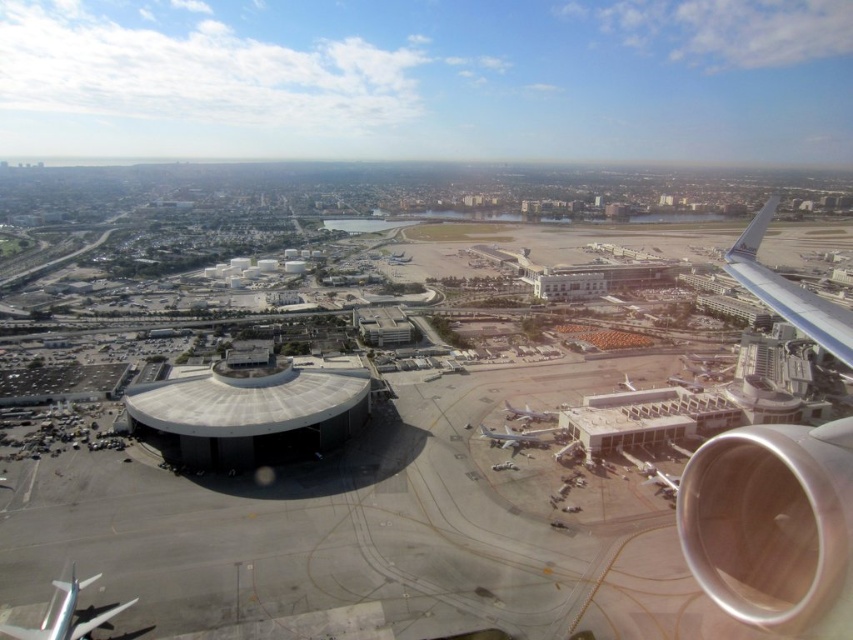
You are a pilot preparing for takeoff and need to ensure there are no obstacles between your aircraft and the runway. The runway is located at the edge of the smooth concrete tarmac at center. What is the minimum distance you must maintain between your aircraft and the nearest obstacle to safely reach the runway?

The minimum distance to maintain is 68.23 meters between your aircraft and the nearest obstacle to safely reach the runway.